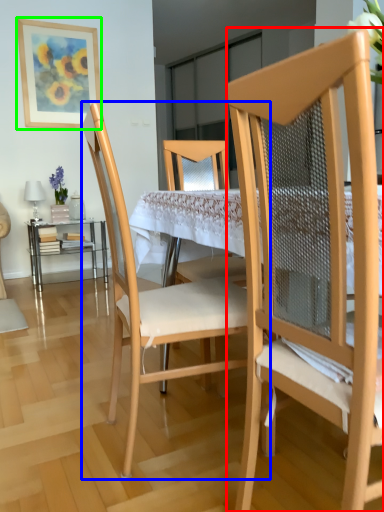
Question: Based on their relative distances, which object is nearer to chair (highlighted by a red box)? Choose from chair (highlighted by a blue box) and picture frame (highlighted by a green box).

Choices:
 (A) chair
 (B) picture frame

Answer: (A)